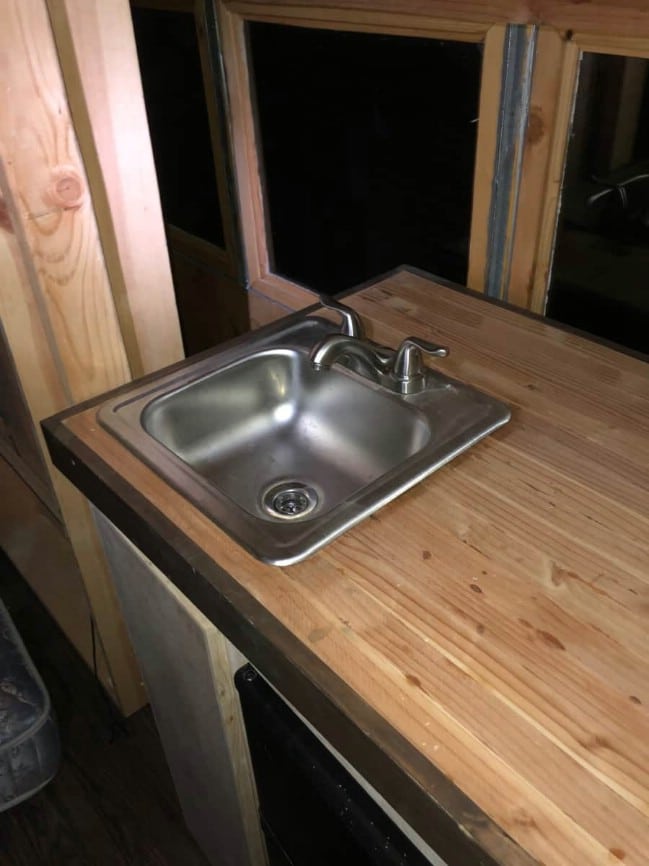
I want to click on window, so click(352, 134), click(622, 220).